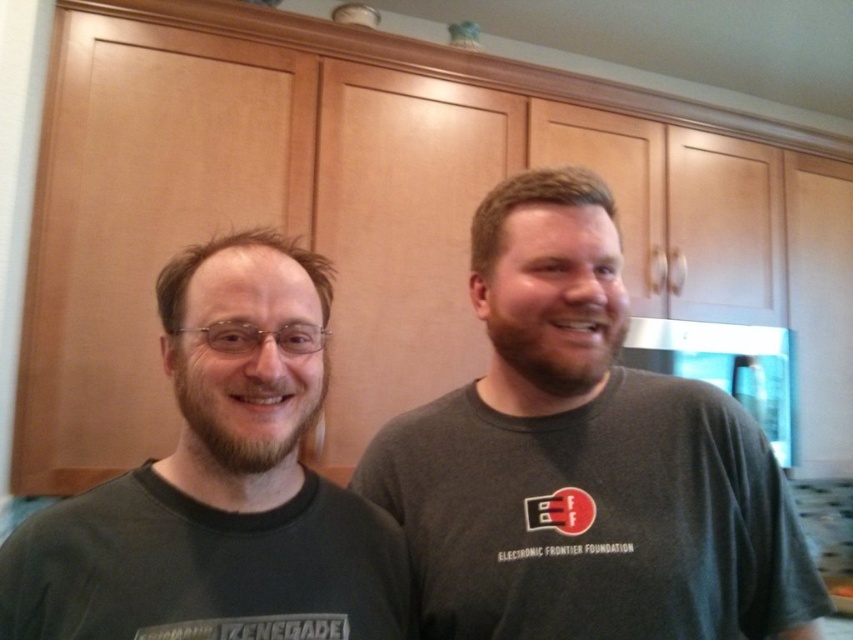
You are a delivery robot with a height of 36 inches. You need to navigate through a kitchen where there is a point at coordinates point (x=764, y=465). Can you safely pass under this point without hitting your head?

The distance of point (x=764, y=465) from camera is 32.33 inches. Since the robot is 36 inches tall, it is taller than the point, so it cannot pass under without hitting its head.

Based on the photo, you are standing in the kitchen and see two points marked in the image. Which point, point [525,356] or point [227,545], is closer to you?

Point [227,545] is closer to you because it is nearer to the camera than point [525,356].